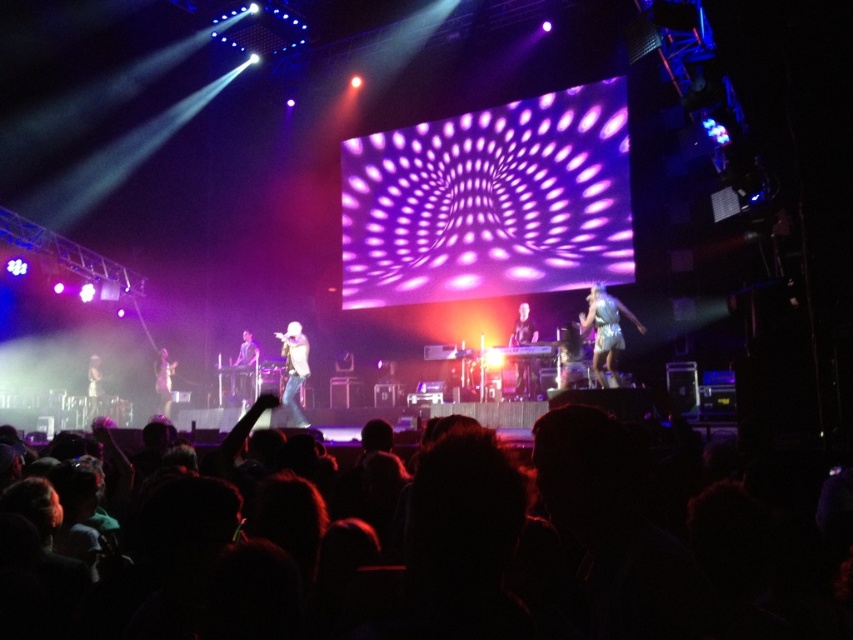
Is point (643, 332) positioned after point (165, 387)?

That is False.

The image size is (853, 640). What do you see at coordinates (605, 332) in the screenshot? I see `white sparkly dress at right` at bounding box center [605, 332].

Locate an element on the screen. white sparkly dress at right is located at coordinates (605, 332).

Is white sparkly dress at right smaller than matte white microphone at lower left?

Incorrect, white sparkly dress at right is not smaller in size than matte white microphone at lower left.

At what (x,y) coordinates should I click in order to perform the action: click on white sparkly dress at right. Please return your answer as a coordinate pair (x, y). Looking at the image, I should click on (605, 332).

Image resolution: width=853 pixels, height=640 pixels. Find the location of `white sparkly dress at right`. white sparkly dress at right is located at coordinates (605, 332).

Between black hair at lower center and matte white keyboard at center, which one has more height?

matte white keyboard at center

Does black hair at lower center have a lesser width compared to matte white keyboard at center?

No.

Where is `black hair at lower center`? black hair at lower center is located at coordinates (579, 548).